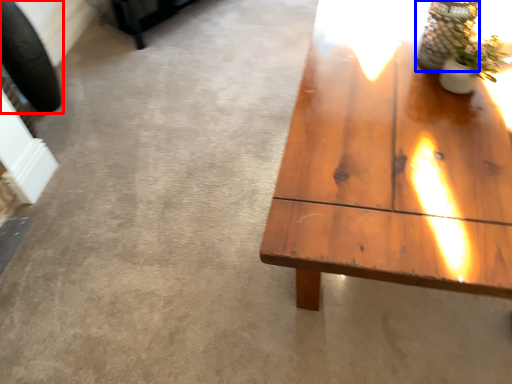
Question: Which of the following is the closest to the observer, car tire (highlighted by a red box) or glass vase (highlighted by a blue box)?

Choices:
 (A) car tire
 (B) glass vase

Answer: (B)